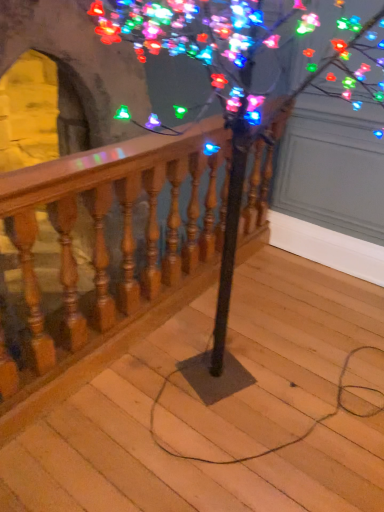
Question: From their relative heights in the image, would you say multicolored lights at upper center is taller or shorter than wooden at center?

Choices:
 (A) tall
 (B) short

Answer: (A)

Question: From the image's perspective, is multicolored lights at upper center positioned above or below wooden at center?

Choices:
 (A) below
 (B) above

Answer: (B)

Question: Estimate the real-world distances between objects in this image. Which object is farther from the wooden at center?

Choices:
 (A) multicolored lights at upper center
 (B) wooden baluster at center

Answer: (A)

Question: Considering the real-world distances, which object is closest to the multicolored lights at upper center?

Choices:
 (A) wooden at center
 (B) wooden baluster at center

Answer: (B)